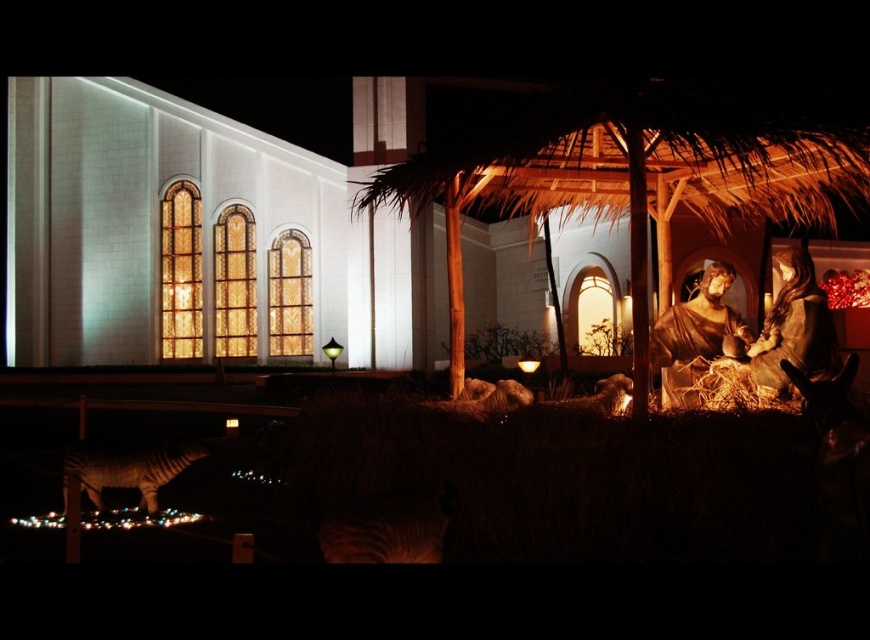
Question: In this image, where is white stone church at center located relative to striped fur tiger at lower left?

Choices:
 (A) below
 (B) above

Answer: (B)

Question: Does white stone church at center have a smaller size compared to striped fur tiger at lower left?

Choices:
 (A) no
 (B) yes

Answer: (A)

Question: Which point is closer to the camera taking this photo?

Choices:
 (A) (10, 260)
 (B) (152, 449)

Answer: (B)

Question: Can you confirm if white stone church at center is wider than striped fur tiger at lower left?

Choices:
 (A) yes
 (B) no

Answer: (A)

Question: Which point is closer to the camera?

Choices:
 (A) striped fur tiger at lower left
 (B) white stone church at center

Answer: (A)